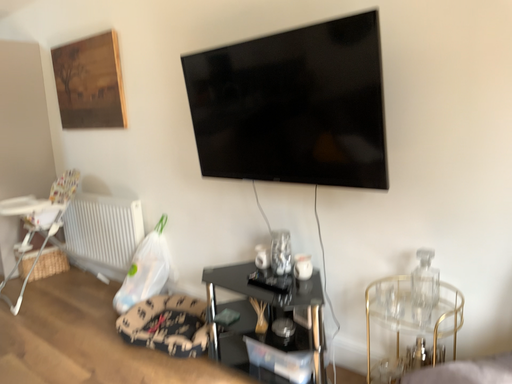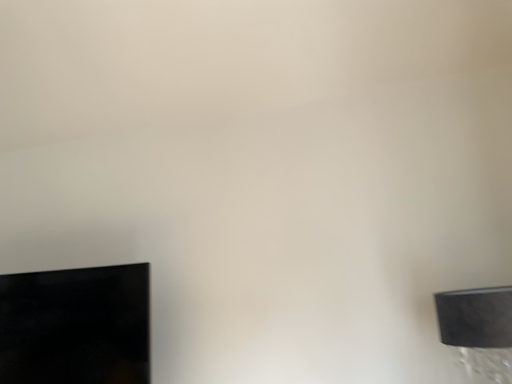
Question: Which way did the camera rotate in the video?

Choices:
 (A) rotated right
 (B) rotated left

Answer: (A)